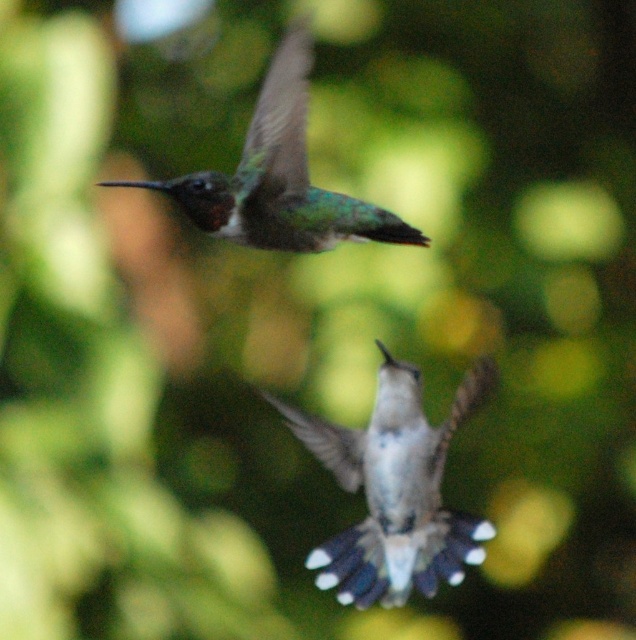
Question: Which point is closer to the camera taking this photo?

Choices:
 (A) (363, 570)
 (B) (280, 221)

Answer: (B)

Question: Does white glossy hummingbird at center appear under green iridescent hummingbird at upper center?

Choices:
 (A) yes
 (B) no

Answer: (A)

Question: Can you confirm if white glossy hummingbird at center is thinner than green iridescent hummingbird at upper center?

Choices:
 (A) no
 (B) yes

Answer: (B)

Question: From the image, what is the correct spatial relationship of white glossy hummingbird at center in relation to green iridescent hummingbird at upper center?

Choices:
 (A) right
 (B) left

Answer: (A)